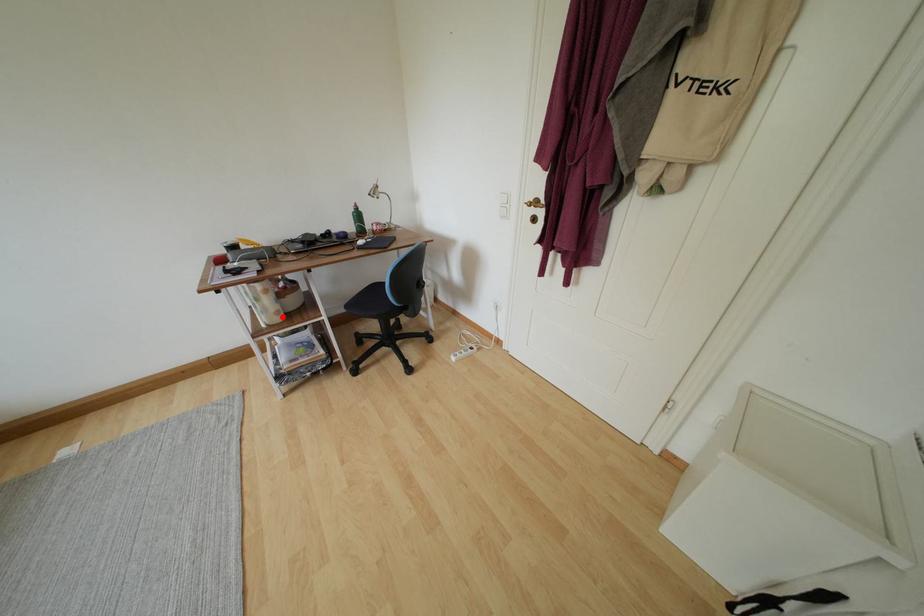
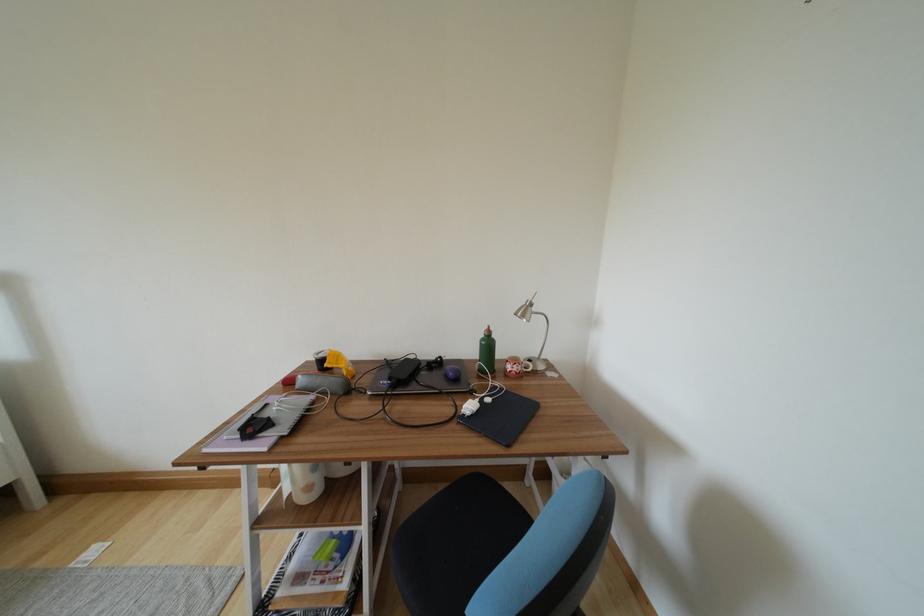
Question: I am providing you with two images of the same scene from different viewpoints. Given a red point in image1, look at the same physical point in image2. Is it:

Choices:
 (A) Closer to the viewpoint
 (B) Farther from the viewpoint

Answer: (B)